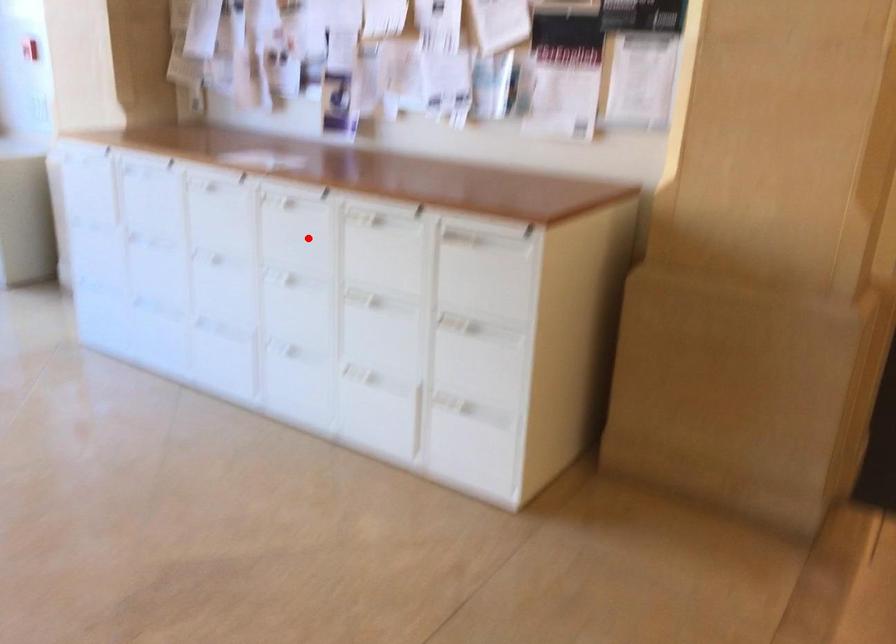
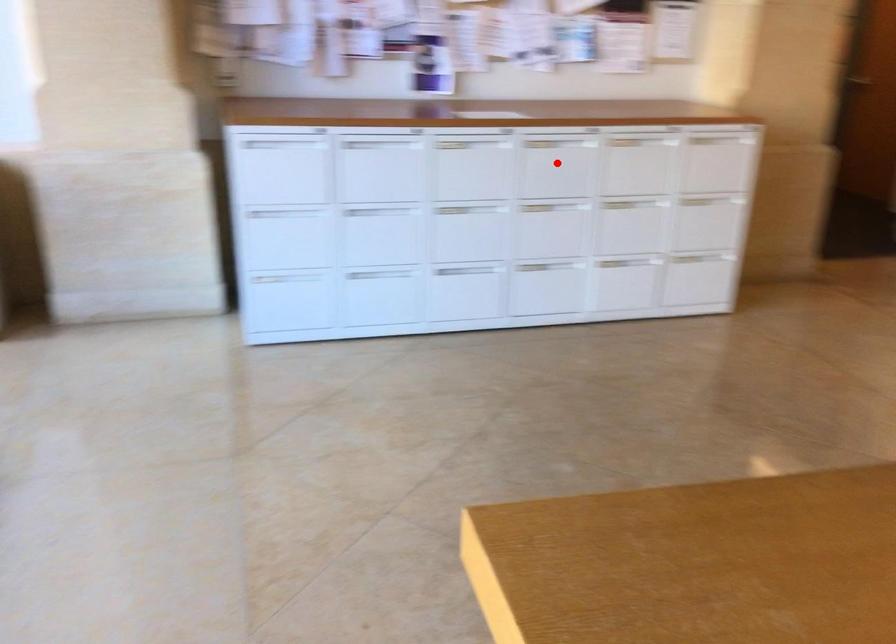
I am providing you with two images of the same scene from different viewpoints. A red point is marked on the first image and another point is marked on the second image. Are the points marked in image1 and image2 representing the same 3D position?

Yes